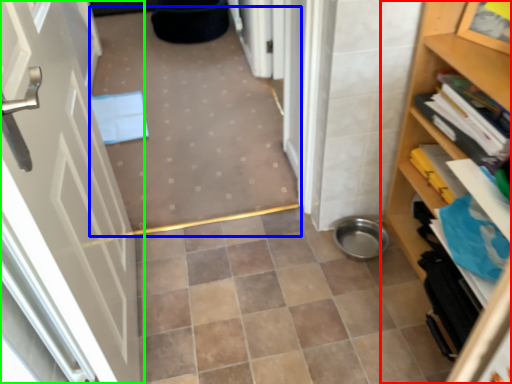
Question: Which is nearer to the shelf (highlighted by a red box)? plain (highlighted by a blue box) or door (highlighted by a green box).

Choices:
 (A) plain
 (B) door

Answer: (B)